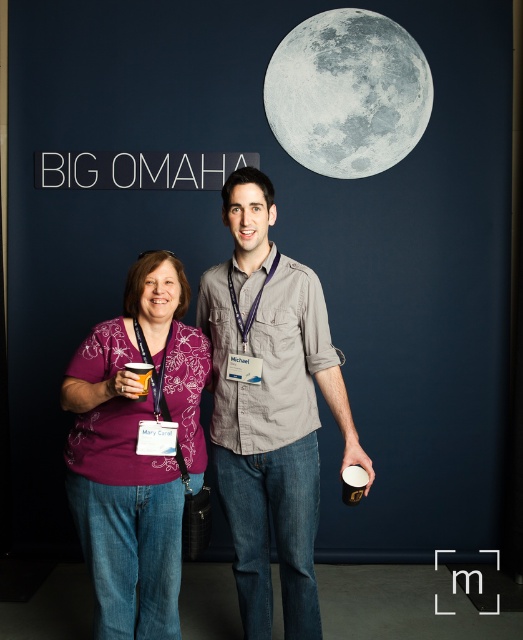
Question: Which of the following is the closest to the observer?

Choices:
 (A) orange paper cup at lower left
 (B) white glossy cup at lower center
 (C) gray textured moon at upper right

Answer: (A)

Question: Among these points, which one is farthest from the camera?

Choices:
 (A) (97, 385)
 (B) (344, 492)
 (C) (133, 364)
 (D) (345, 150)

Answer: (D)

Question: Does gray textured moon at upper right appear on the right side of orange paper cup at lower left?

Choices:
 (A) yes
 (B) no

Answer: (A)

Question: Can you confirm if gray cotton shirt at center is wider than orange paper cup at lower left?

Choices:
 (A) no
 (B) yes

Answer: (B)

Question: Can you confirm if gray cotton shirt at center is positioned above gray textured moon at upper right?

Choices:
 (A) yes
 (B) no

Answer: (B)

Question: Which of the following is the farthest from the observer?

Choices:
 (A) (344, 484)
 (B) (276, 417)
 (C) (143, 372)

Answer: (B)